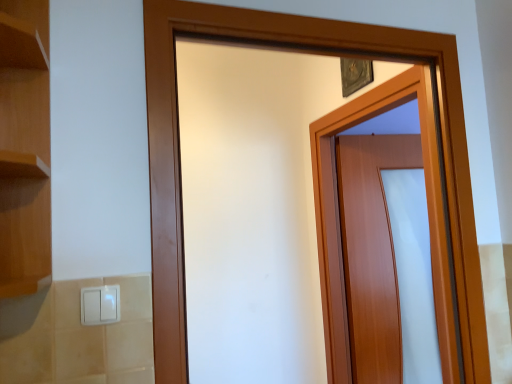
Find the location of a particular element. This screenshot has height=384, width=512. wooden door at center, placed as the second door when sorted from back to front is located at coordinates (308, 45).

Which is in front, wooden door at center, which is counted as the 1th door, starting from the back, or wooden door at center, arranged as the 1th door when viewed from the front?

wooden door at center, arranged as the 1th door when viewed from the front, is in front.

Can you see wooden door at center, which is counted as the 1th door, starting from the back, touching wooden door at center, placed as the second door when sorted from back to front?

No, wooden door at center, which is counted as the 1th door, starting from the back, is not beside wooden door at center, placed as the second door when sorted from back to front.

Considering the relative positions of wooden door at center, arranged as the 2th door when viewed from the front, and wooden door at center, arranged as the 1th door when viewed from the front, in the image provided, is wooden door at center, arranged as the 2th door when viewed from the front, to the right of wooden door at center, arranged as the 1th door when viewed from the front, from the viewer's perspective?

Correct, you'll find wooden door at center, arranged as the 2th door when viewed from the front, to the right of wooden door at center, arranged as the 1th door when viewed from the front.

Is wooden door at center, placed as the second door when sorted from back to front, situated inside white plastic light switch at lower left or outside?

wooden door at center, placed as the second door when sorted from back to front, is spatially situated outside white plastic light switch at lower left.

From a real-world perspective, which is physically below, wooden door at center, arranged as the 1th door when viewed from the front, or white plastic light switch at lower left?

From a 3D spatial view, white plastic light switch at lower left is below.

How different are the orientations of wooden door at center, arranged as the 1th door when viewed from the front, and white plastic light switch at lower left in degrees?

There is a 1.96-degree angle between the facing directions of wooden door at center, arranged as the 1th door when viewed from the front, and white plastic light switch at lower left.

Which is farther from the camera, [174,364] or [93,319]?

The point [174,364] is more distant.

From the image's perspective, which one is positioned higher, white plastic light switch at lower left or wooden door at center, placed as the second door when sorted from back to front?

wooden door at center, placed as the second door when sorted from back to front, appears higher in the image.

Would you say white plastic light switch at lower left is outside wooden door at center, placed as the second door when sorted from back to front?

Yes.

Considering the sizes of white plastic light switch at lower left and wooden door at center, placed as the second door when sorted from back to front, in the image, is white plastic light switch at lower left taller or shorter than wooden door at center, placed as the second door when sorted from back to front,?

In the image, white plastic light switch at lower left appears to be shorter than wooden door at center, placed as the second door when sorted from back to front.

Considering the points (106, 286) and (425, 43), which point is behind, point (106, 286) or point (425, 43)?

The point (425, 43) is more distant.

Consider the image. From the image's perspective, which one is positioned lower, white plastic light switch at lower left or wooden door at center, which is counted as the 1th door, starting from the back?

wooden door at center, which is counted as the 1th door, starting from the back, from the image's perspective.

Considering the relative sizes of white plastic light switch at lower left and wooden door at center, arranged as the 2th door when viewed from the front, in the image provided, is white plastic light switch at lower left bigger than wooden door at center, arranged as the 2th door when viewed from the front,?

No.

How distant is white plastic light switch at lower left from wooden door at center, arranged as the 2th door when viewed from the front?

white plastic light switch at lower left is 1.38 meters away from wooden door at center, arranged as the 2th door when viewed from the front.

Considering their positions, is wooden door at center, arranged as the 1th door when viewed from the front, located in front of or behind wooden door at center, arranged as the 2th door when viewed from the front?

wooden door at center, arranged as the 1th door when viewed from the front, is positioned closer to the viewer than wooden door at center, arranged as the 2th door when viewed from the front.

Is wooden door at center, placed as the second door when sorted from back to front, located outside wooden door at center, arranged as the 2th door when viewed from the front?

Yes, wooden door at center, placed as the second door when sorted from back to front, is outside of wooden door at center, arranged as the 2th door when viewed from the front.

Based on the photo, what's the angular difference between wooden door at center, placed as the second door when sorted from back to front, and wooden door at center, which is counted as the 1th door, starting from the back,'s facing directions?

90.5 degrees.

How much distance is there between wooden door at center, placed as the second door when sorted from back to front, and wooden door at center, which is counted as the 1th door, starting from the back?

wooden door at center, placed as the second door when sorted from back to front, and wooden door at center, which is counted as the 1th door, starting from the back, are 56.52 centimeters apart.

From a real-world perspective, is wooden door at center, arranged as the 2th door when viewed from the front, over white plastic light switch at lower left?

No, from a real-world perspective, wooden door at center, arranged as the 2th door when viewed from the front, is not on top of white plastic light switch at lower left.

Is wooden door at center, which is counted as the 1th door, starting from the back, taller or shorter than white plastic light switch at lower left?

In the image, wooden door at center, which is counted as the 1th door, starting from the back, appears to be taller than white plastic light switch at lower left.

Measure the distance from wooden door at center, arranged as the 2th door when viewed from the front, to white plastic light switch at lower left.

wooden door at center, arranged as the 2th door when viewed from the front, and white plastic light switch at lower left are 4.53 feet apart from each other.

Would you say wooden door at center, arranged as the 2th door when viewed from the front, contains white plastic light switch at lower left?

No, white plastic light switch at lower left is not surrounded by wooden door at center, arranged as the 2th door when viewed from the front.

Identify the location of door lying on the left of wooden door at center, arranged as the 2th door when viewed from the front. The image size is (512, 384). (308, 45).

I want to click on the 1st door behind when counting from the white plastic light switch at lower left, so click(x=308, y=45).

When comparing their distances from wooden door at center, arranged as the 2th door when viewed from the front, does white plastic light switch at lower left or wooden door at center, placed as the second door when sorted from back to front, seem further?

Based on the image, white plastic light switch at lower left appears to be further to wooden door at center, arranged as the 2th door when viewed from the front.

When comparing their distances from white plastic light switch at lower left, does wooden door at center, placed as the second door when sorted from back to front, or wooden door at center, which is counted as the 1th door, starting from the back, seem closer?

wooden door at center, placed as the second door when sorted from back to front, lies closer to white plastic light switch at lower left than the other object.

Based on their spatial positions, is wooden door at center, which is counted as the 1th door, starting from the back, or wooden door at center, placed as the second door when sorted from back to front, further from white plastic light switch at lower left?

wooden door at center, which is counted as the 1th door, starting from the back.

Considering their positions, is white plastic light switch at lower left positioned closer to wooden door at center, arranged as the 1th door when viewed from the front, than wooden door at center, arranged as the 2th door when viewed from the front?

wooden door at center, arranged as the 2th door when viewed from the front, is closer to wooden door at center, arranged as the 1th door when viewed from the front.

Based on their spatial positions, is wooden door at center, which is counted as the 1th door, starting from the back, or white plastic light switch at lower left closer to wooden door at center, arranged as the 1th door when viewed from the front?

The object closer to wooden door at center, arranged as the 1th door when viewed from the front, is wooden door at center, which is counted as the 1th door, starting from the back.

From the image, which object appears to be nearer to wooden door at center, arranged as the 2th door when viewed from the front, wooden door at center, placed as the second door when sorted from back to front, or white plastic light switch at lower left?

wooden door at center, placed as the second door when sorted from back to front, is positioned closer to the anchor wooden door at center, arranged as the 2th door when viewed from the front.

You are a GUI agent. You are given a task and a screenshot of the screen. Output one action in this format:
    pyautogui.click(x=<x>, y=<y>)
    Task: Click on the door between white plastic light switch at lower left and wooden door at center, arranged as the 2th door when viewed from the front, from left to right
    The height and width of the screenshot is (384, 512).
    Given the screenshot: What is the action you would take?
    pyautogui.click(x=308, y=45)